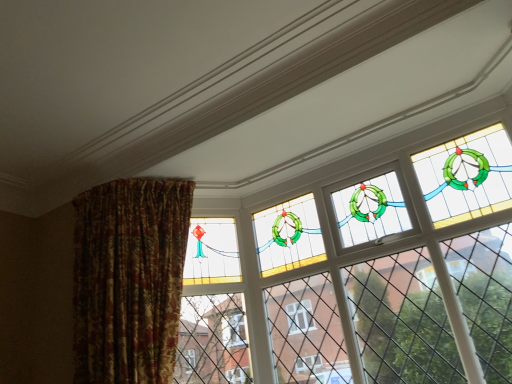
Question: Is floral fabric curtain at left to the left of stained glass window at upper center from the viewer's perspective?

Choices:
 (A) yes
 (B) no

Answer: (A)

Question: Can you confirm if floral fabric curtain at left is thinner than stained glass window at upper center?

Choices:
 (A) no
 (B) yes

Answer: (A)

Question: Considering the relative sizes of floral fabric curtain at left and stained glass window at upper center in the image provided, is floral fabric curtain at left taller than stained glass window at upper center?

Choices:
 (A) yes
 (B) no

Answer: (B)

Question: Does floral fabric curtain at left lie in front of stained glass window at upper center?

Choices:
 (A) yes
 (B) no

Answer: (B)

Question: Is stained glass window at upper center located within floral fabric curtain at left?

Choices:
 (A) no
 (B) yes

Answer: (A)

Question: Is floral fabric curtain at left outside of stained glass window at upper center?

Choices:
 (A) no
 (B) yes

Answer: (B)

Question: Is stained glass window at upper center next to floral fabric curtain at left and touching it?

Choices:
 (A) no
 (B) yes

Answer: (A)

Question: Is stained glass window at upper center oriented towards floral fabric curtain at left?

Choices:
 (A) yes
 (B) no

Answer: (A)

Question: Is stained glass window at upper center not inside floral fabric curtain at left?

Choices:
 (A) yes
 (B) no

Answer: (A)

Question: From the image's perspective, is stained glass window at upper center over floral fabric curtain at left?

Choices:
 (A) yes
 (B) no

Answer: (A)

Question: From a real-world perspective, is stained glass window at upper center under floral fabric curtain at left?

Choices:
 (A) yes
 (B) no

Answer: (A)

Question: Considering the relative positions of stained glass window at upper center and floral fabric curtain at left in the image provided, is stained glass window at upper center to the left of floral fabric curtain at left from the viewer's perspective?

Choices:
 (A) yes
 (B) no

Answer: (B)

Question: From the image's perspective, is floral fabric curtain at left located above or below stained glass window at upper center?

Choices:
 (A) above
 (B) below

Answer: (B)